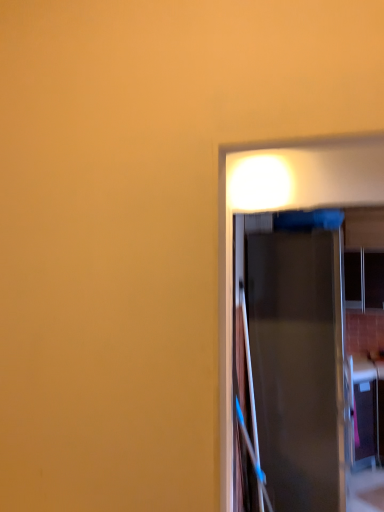
What is the approximate height of transparent glass window at right?

23.73 inches.

Where is `transparent glass window at right`? Image resolution: width=384 pixels, height=512 pixels. transparent glass window at right is located at coordinates (374, 279).

The height and width of the screenshot is (512, 384). Describe the element at coordinates (374, 279) in the screenshot. I see `transparent glass window at right` at that location.

What is the approximate height of metallic silver door at center?

metallic silver door at center is 6.62 feet in height.

What do you see at coordinates (294, 355) in the screenshot?
I see `metallic silver door at center` at bounding box center [294, 355].

Locate an element on the screen. The height and width of the screenshot is (512, 384). metallic silver door at center is located at coordinates (294, 355).

Where is `transparent glass window at right`? transparent glass window at right is located at coordinates (374, 279).

Consider the image. Considering the positions of objects metallic silver door at center and transparent glass window at right in the image provided, who is more to the right, metallic silver door at center or transparent glass window at right?

Positioned to the right is transparent glass window at right.

Considering the positions of objects metallic silver door at center and transparent glass window at right in the image provided, who is behind, metallic silver door at center or transparent glass window at right?

transparent glass window at right is more distant.

Which point is more distant from viewer, (x=293, y=455) or (x=345, y=274)?

The point (x=345, y=274) is more distant.

From the image's perspective, is metallic silver door at center located above or below transparent glass window at right?

From the image's perspective, metallic silver door at center appears below transparent glass window at right.

From a real-world perspective, who is located lower, metallic silver door at center or transparent glass window at right?

metallic silver door at center, from a real-world perspective.

Does metallic silver door at center have a lesser width compared to transparent glass window at right?

Incorrect, the width of metallic silver door at center is not less than that of transparent glass window at right.

Does metallic silver door at center have a lesser height compared to transparent glass window at right?

No, metallic silver door at center is not shorter than transparent glass window at right.

Considering the relative sizes of metallic silver door at center and transparent glass window at right in the image provided, is metallic silver door at center smaller than transparent glass window at right?

No.

Is metallic silver door at center surrounding transparent glass window at right?

That's incorrect, transparent glass window at right is not inside metallic silver door at center.

Is metallic silver door at center far from transparent glass window at right?

Yes, metallic silver door at center and transparent glass window at right are located far from each other.

Does metallic silver door at center turn towards transparent glass window at right?

No, metallic silver door at center is not facing towards transparent glass window at right.

There is a metallic silver door at center. Identify the location of window above it (from a real-world perspective). (374, 279).

Is transparent glass window at right at the left side of metallic silver door at center?

No.

Is transparent glass window at right in front of metallic silver door at center?

No, it is not.

Does point (373, 260) come in front of point (248, 303)?

No, it is behind (248, 303).

From the image's perspective, is transparent glass window at right under metallic silver door at center?

No, from the image's perspective, transparent glass window at right is not below metallic silver door at center.

From a real-world perspective, who is located lower, transparent glass window at right or metallic silver door at center?

metallic silver door at center is physically lower.

Does transparent glass window at right have a lesser width compared to metallic silver door at center?

Correct, the width of transparent glass window at right is less than that of metallic silver door at center.

Does transparent glass window at right have a greater height compared to metallic silver door at center?

In fact, transparent glass window at right may be shorter than metallic silver door at center.

Can you confirm if transparent glass window at right is bigger than metallic silver door at center?

No.

Is metallic silver door at center completely or partially inside transparent glass window at right?

No, metallic silver door at center is located outside of transparent glass window at right.

Is transparent glass window at right with metallic silver door at center?

transparent glass window at right is not next to metallic silver door at center, and they're not touching.

Is transparent glass window at right aimed at metallic silver door at center?

Yes, transparent glass window at right is facing metallic silver door at center.

How far apart are transparent glass window at right and metallic silver door at center?

1.73 meters.

Where is `door below the transparent glass window at right (from a real-world perspective)`? This screenshot has width=384, height=512. door below the transparent glass window at right (from a real-world perspective) is located at coordinates (294, 355).

The width and height of the screenshot is (384, 512). Identify the location of door below the transparent glass window at right (from the image's perspective). (294, 355).

Find the location of `door below the transparent glass window at right (from a real-world perspective)`. door below the transparent glass window at right (from a real-world perspective) is located at coordinates (294, 355).